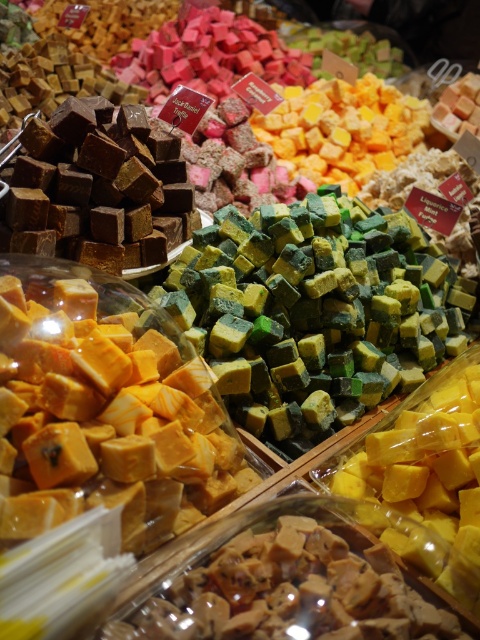
You are a customer at the confectionery shop and want to buy both the green matte fudge at center and the matte brown fudge at center. The store has a promotion where if one item is larger than the other, you can get the smaller one for half price. Which fudge would be eligible for the discount?

The matte brown fudge at center is smaller than the green matte fudge at center, so the matte brown fudge at center would be eligible for the half price discount.

You are a customer at the candy shop and want to buy both the green matte fudge at center and the matte brown fudge at center. When looking at the display, which one do you see first?

The green matte fudge at center is located above the matte brown fudge at center, so you would see the green matte fudge at center first.

You are a customer in the candy shop and want to buy the green matte fudge at center. The shopkeeper tells you that the candy you want is located at point (312, 314). Can you confirm if the point matches the location of the green matte fudge at center?

Yes, the point (312, 314) corresponds to the green matte fudge at center as stated by the shopkeeper.